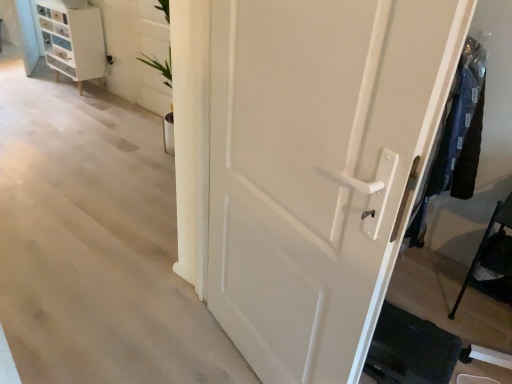
Question: From the image's perspective, is white glossy chest of drawers at upper left above or below dark blue fabric at right?

Choices:
 (A) below
 (B) above

Answer: (B)

Question: Considering the positions of point (69, 31) and point (470, 84), is point (69, 31) closer or farther from the camera than point (470, 84)?

Choices:
 (A) closer
 (B) farther

Answer: (B)

Question: Estimate the real-world distances between objects in this image. Which object is farther from the white glossy chest of drawers at upper left?

Choices:
 (A) dark blue fabric at right
 (B) white matte door at center
 (C) black metal cane at lower right

Answer: (C)

Question: Estimate the real-world distances between objects in this image. Which object is closer to the white matte door at center?

Choices:
 (A) black metal cane at lower right
 (B) white glossy chest of drawers at upper left
 (C) dark blue fabric at right

Answer: (C)